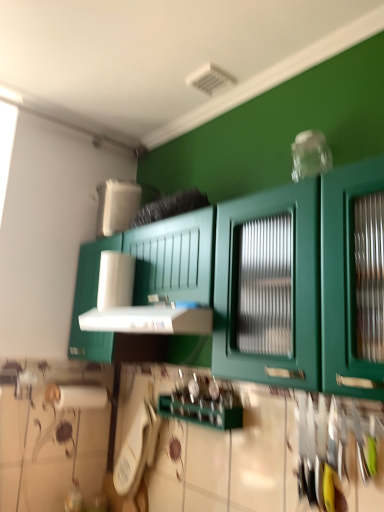
Question: Based on their sizes in the image, would you say white plastic vent at center is bigger or smaller than green matte cabinet at center?

Choices:
 (A) big
 (B) small

Answer: (B)

Question: Relative to green matte cabinet at center, is white plastic vent at center in front or behind?

Choices:
 (A) front
 (B) behind

Answer: (B)

Question: Which object is positioned closest to the white plastic phone at lower center?

Choices:
 (A) green matte cabinet at center
 (B) white plastic vent at center

Answer: (B)

Question: Which of these objects is positioned farthest from the white plastic vent at center?

Choices:
 (A) green matte cabinet at center
 (B) white plastic phone at lower center

Answer: (B)